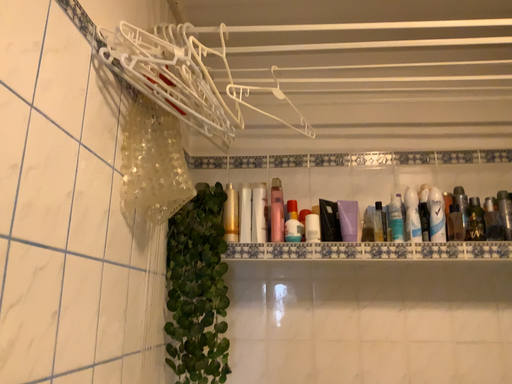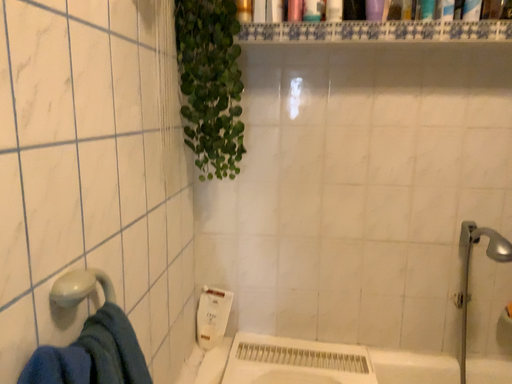
Question: Which way did the camera rotate in the video?

Choices:
 (A) rotated downward
 (B) rotated upward

Answer: (A)